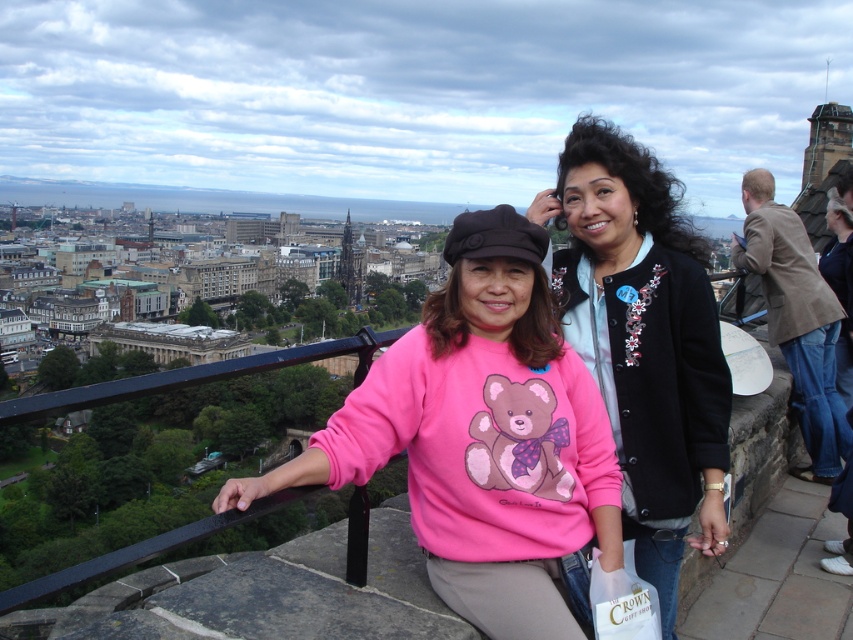
What is located at the coordinates point [480,436]?

The pink fleece sweater at center is located at point [480,436].

You are a photographer trying to capture a photo of the pink fleece sweater at center and the brown leather jacket at upper right. Which of the two items is shorter in height?

The pink fleece sweater at center is shorter than the brown leather jacket at upper right.

You are a photographer trying to capture the best shot of the scene. You need to focus on the black matte jacket at center. Where exactly should you aim your camera to ensure it captures the jacket perfectly?

To capture the black matte jacket at center perfectly, aim your camera at the coordinates point (643, 340), as that is where the black matte jacket at center is positioned.